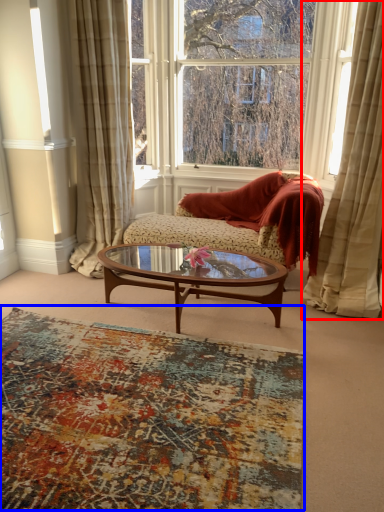
Question: Which of the following is the farthest to the observer, curtain (highlighted by a red box) or plain (highlighted by a blue box)?

Choices:
 (A) curtain
 (B) plain

Answer: (A)